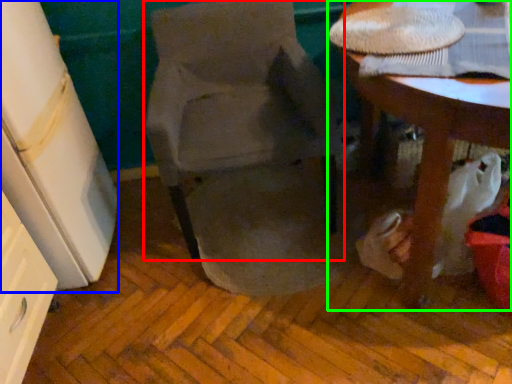
Question: Considering the real-world distances, which object is closest to chair (highlighted by a red box)? leftover (highlighted by a blue box) or table (highlighted by a green box).

Choices:
 (A) leftover
 (B) table

Answer: (A)